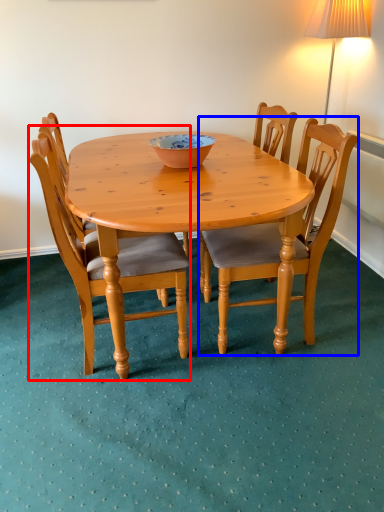
Question: Which object appears farthest to the camera in this image, chair (highlighted by a red box) or chair (highlighted by a blue box)?

Choices:
 (A) chair
 (B) chair

Answer: (B)